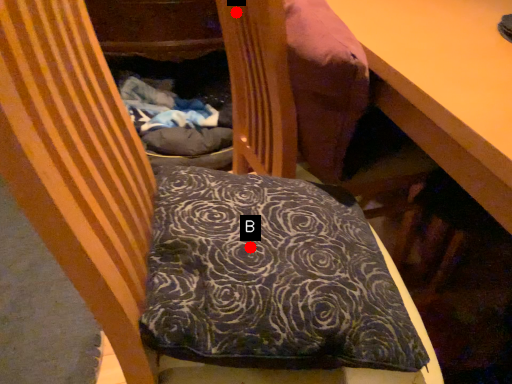
Question: Two points are circled on the image, labeled by A and B beside each circle. Which point is closer to the camera?

Choices:
 (A) A is closer
 (B) B is closer

Answer: (B)